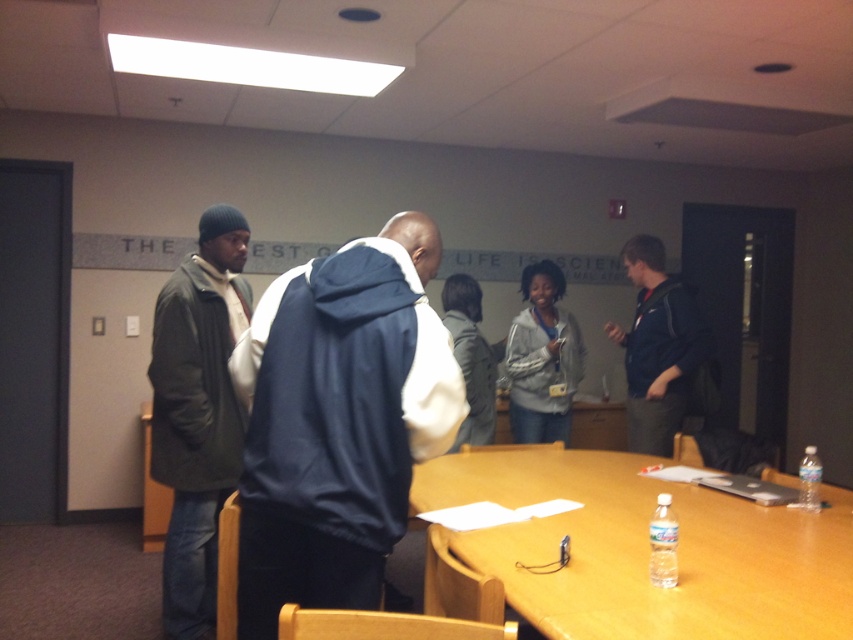
Question: From the image, what is the correct spatial relationship of matte green jacket at left in relation to dark blue jacket at center?

Choices:
 (A) above
 (B) below

Answer: (B)

Question: Does navy blue jacket at center lie in front of wooden table at center?

Choices:
 (A) yes
 (B) no

Answer: (B)

Question: Considering the real-world distances, which object is closest to the dark blue jacket at center?

Choices:
 (A) wooden table at center
 (B) navy blue jacket at center

Answer: (A)

Question: Which point is farther to the camera?

Choices:
 (A) matte green jacket at left
 (B) navy blue jacket at center

Answer: (A)

Question: Does navy blue jacket at center come in front of wooden table at center?

Choices:
 (A) yes
 (B) no

Answer: (B)

Question: Which object is positioned farthest from the silver metallic jacket at center?

Choices:
 (A) matte green jacket at left
 (B) navy blue jacket at center

Answer: (B)